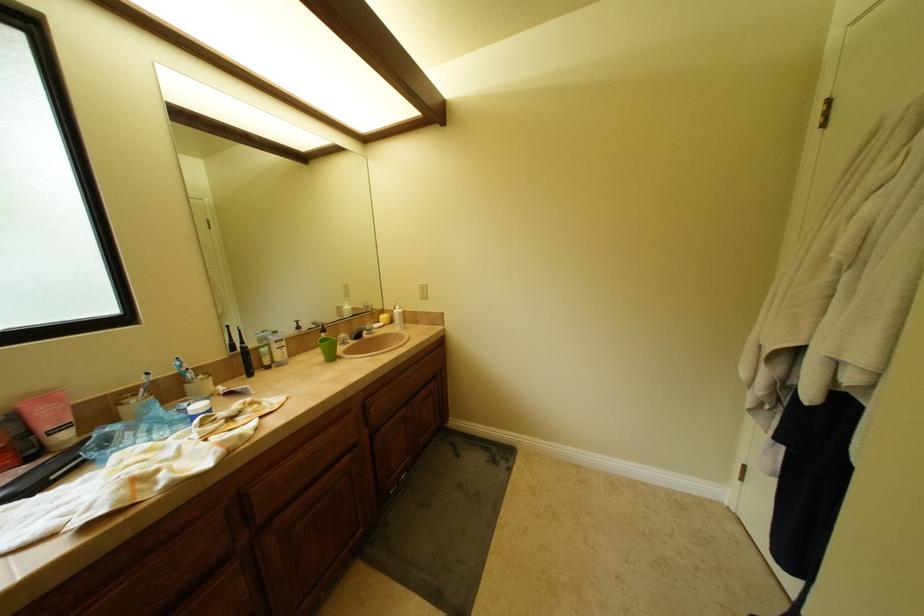
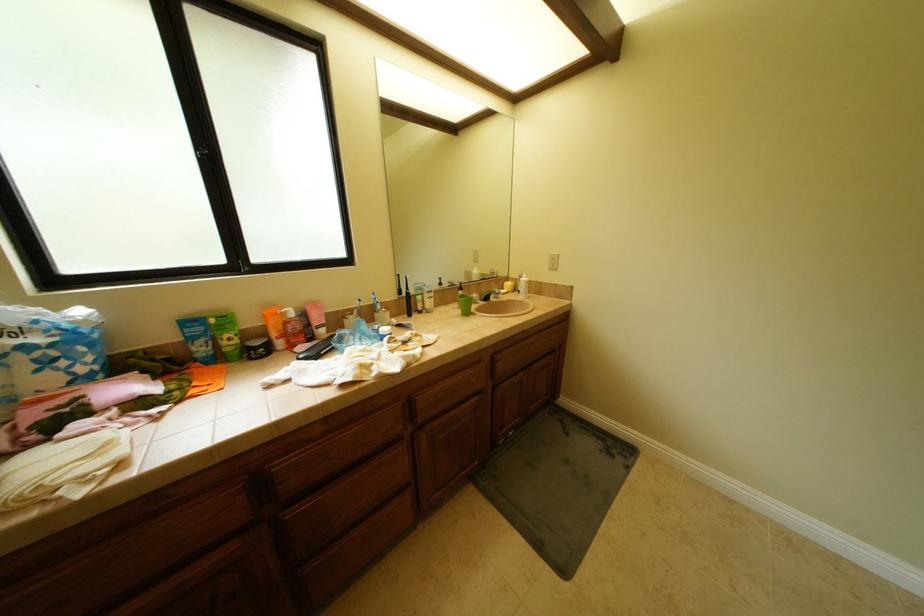
Question: The images are taken continuously from a first-person perspective. In which direction is your viewpoint rotating?

Choices:
 (A) Left
 (B) Right
 (C) Up
 (D) Down

Answer: (A)